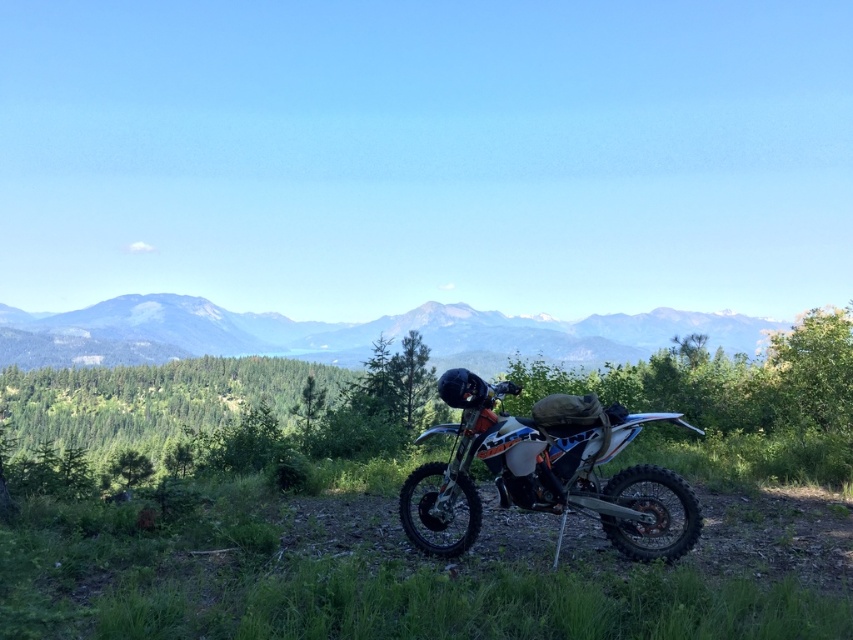
You are planning to take a dirt bike ride and see the green forested mountain at center. Based on the slope direction, will riding towards the mountain require going uphill or downhill?

The dirt bike is parked on a grassy slope that gently slopes downwards towards the green forested mountain at center. Therefore, riding towards the mountain would mean going downhill.

You are planning to take a photo of the matte black motorcycle at center and the green forested mountain at center. Which object should you zoom in more on to ensure both fit in the frame?

The green forested mountain at center is wider than the matte black motorcycle at center, so you should zoom in more on the motorcycle to ensure both fit in the frame.